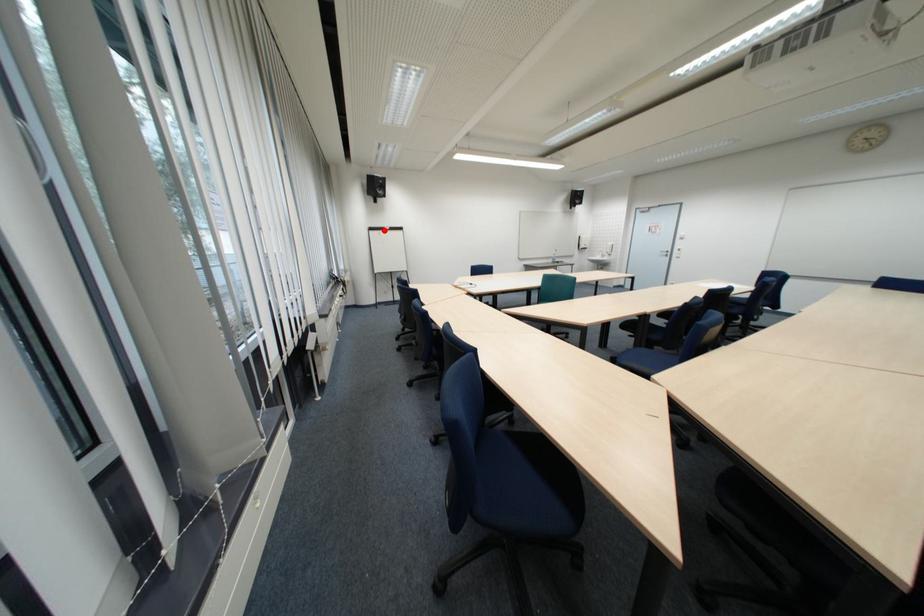
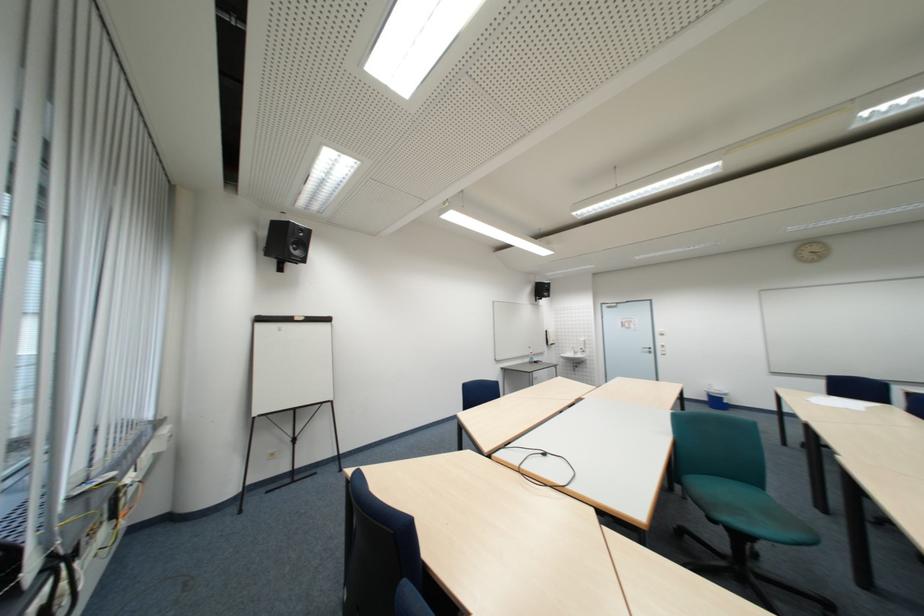
Locate, in the second image, the point that corresponds to the highlighted location in the first image.

(273, 321)